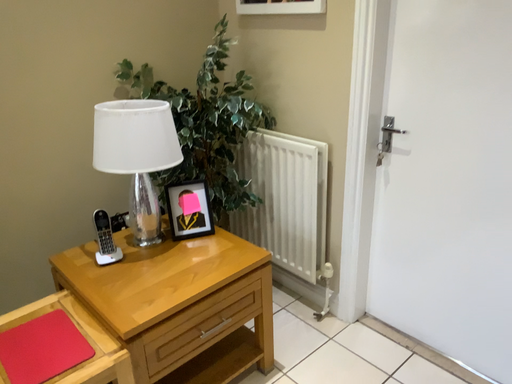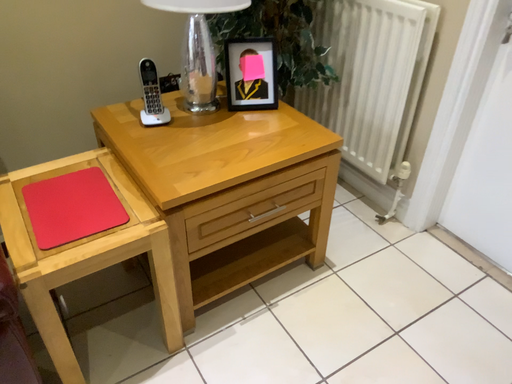
Question: How did the camera likely rotate when shooting the video?

Choices:
 (A) rotated downward
 (B) rotated upward

Answer: (A)